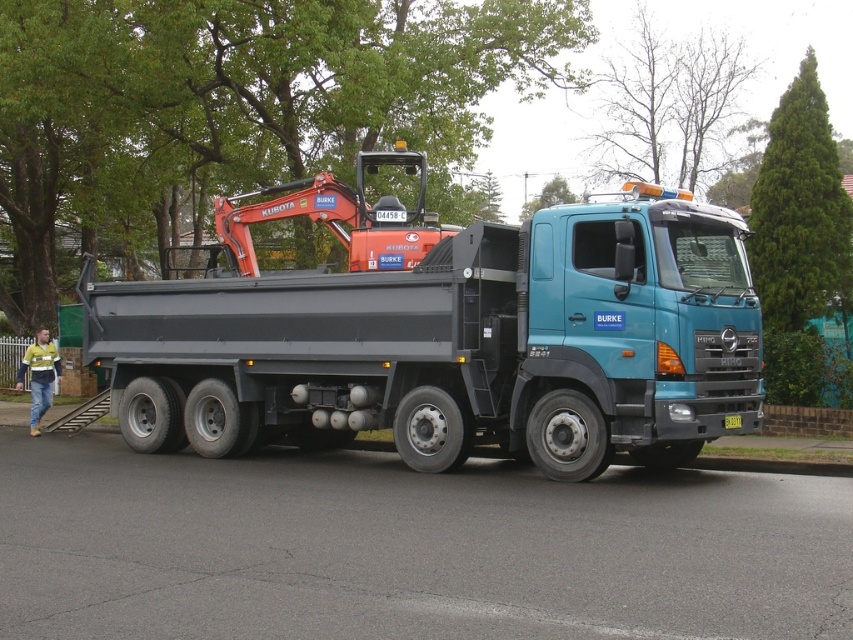
You are a delivery driver who needs to park your truck in a space that can only accommodate vehicles up to the size of the matte black truck at center. You see the orange metallic excavator at center nearby. Can you safely park your truck in this space without exceeding the size limit?

The matte black truck at center is smaller than the orange metallic excavator at center, so if the parking space is sized for the matte black truck at center, the excavator is too large to fit. However, your delivery truck should be similar in size to the matte black truck at center, so it should fit within the space.

You are a delivery driver who needs to park your truck next to the orange metallic excavator at center. The parking space is only 2 meters wide. Can your matte black truck at center fit into the space without hitting the excavator?

The distance between the matte black truck at center and the orange metallic excavator at center is 1.96 meters. Since the parking space is 2 meters wide, the matte black truck at center can fit into the space without hitting the excavator as the distance is slightly less than the space width.

You are standing at the point labeled point [410,150] and want to walk to the point labeled point [421,368]. Which direction should you face to walk towards your destination?

You should face forward because point [421,368] is in front of point [410,150].